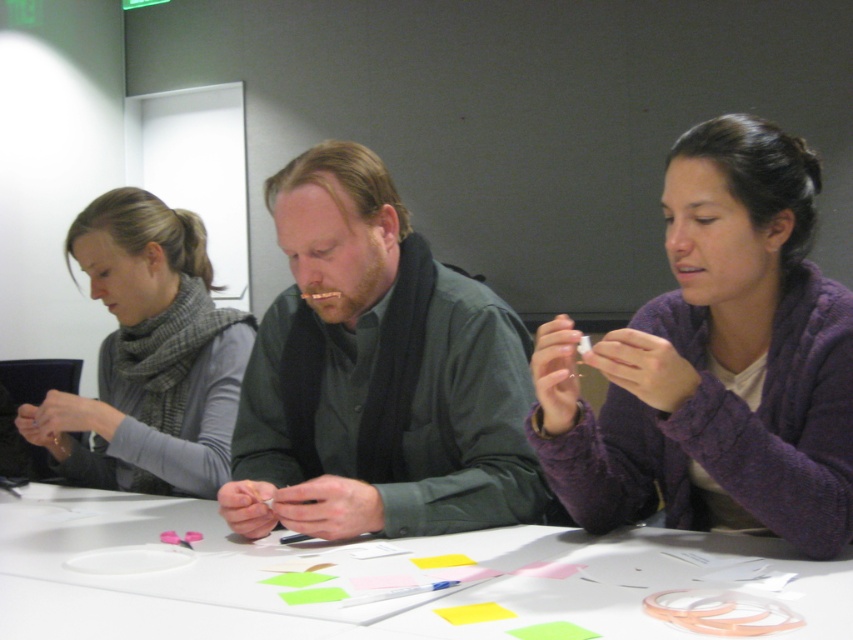
Does green matte shirt at center appear under white paper at center?

No.

Between green matte shirt at center and white paper at center, which one is positioned higher?

green matte shirt at center is above.

This screenshot has height=640, width=853. What do you see at coordinates (376, 376) in the screenshot? I see `green matte shirt at center` at bounding box center [376, 376].

Locate an element on the screen. This screenshot has height=640, width=853. green matte shirt at center is located at coordinates (376, 376).

Does white paper at center have a lesser height compared to gray wool scarf at left?

Indeed, white paper at center has a lesser height compared to gray wool scarf at left.

Describe the element at coordinates (355, 577) in the screenshot. I see `white paper at center` at that location.

In order to click on white paper at center in this screenshot , I will do `click(355, 577)`.

Is the position of purple fuzzy sweater at center more distant than that of white paper at center?

That is True.

Does purple fuzzy sweater at center have a larger size compared to white paper at center?

Yes.

Which is behind, point (711, 506) or point (577, 593)?

Positioned behind is point (711, 506).

Locate an element on the screen. This screenshot has height=640, width=853. purple fuzzy sweater at center is located at coordinates (717, 362).